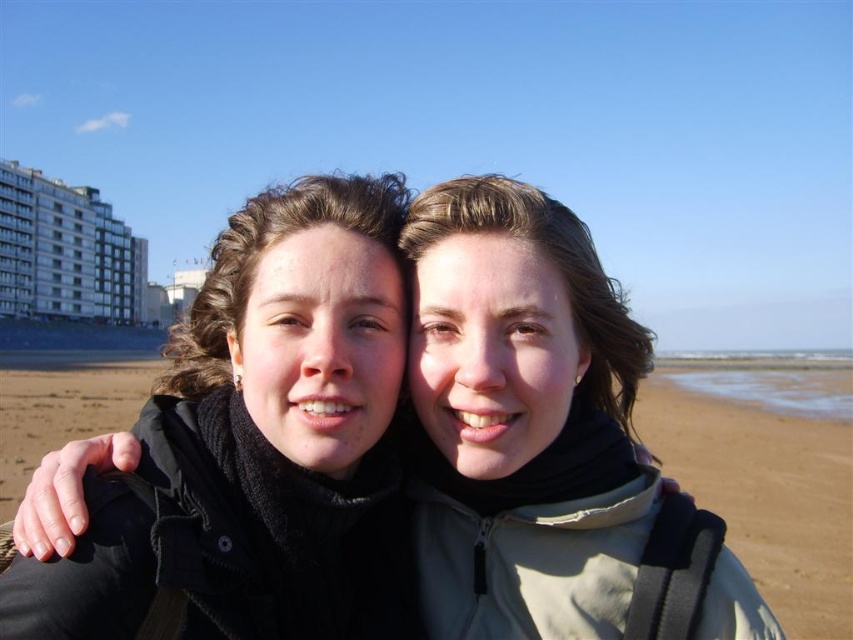
You are a photographer trying to capture a closeup of the matte black jacket at center. The camera you are using has a focus point at coordinate point (x=521, y=419). Will this focus point help you capture the matte black jacket at center clearly?

The matte black jacket at center is located at point (x=521, y=419), so yes, the focus point at coordinate point (x=521, y=419) will help capture the matte black jacket at center clearly.

You are a photographer trying to focus on the point at coordinates (x=258, y=445). Based on the scene description, which object should you adjust your camera to focus on?

The point at coordinates (x=258, y=445) is on the black matte jacket at left, so you should adjust your camera to focus on the black matte jacket at left.

You are a photographer trying to capture the two points in the image. Which point, point [193,600] or point [462,244], is positioned closer to you?

Point [193,600] is closer to the viewer than point [462,244].